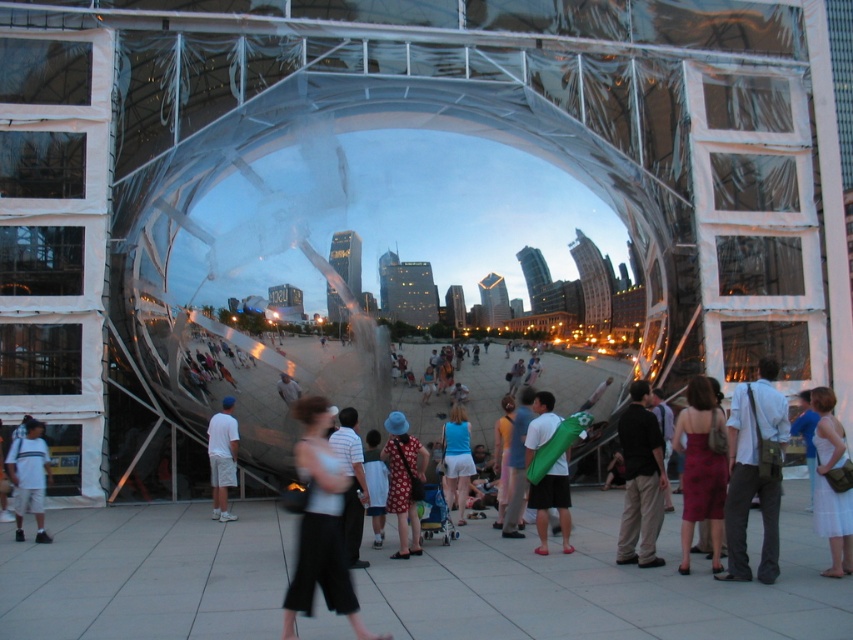
Looking at this image, who is higher up, green fabric bag at center or matte blue shorts at center?

green fabric bag at center is above.

Can you confirm if green fabric bag at center is positioned above matte blue shorts at center?

Yes.

Where is `green fabric bag at center`? green fabric bag at center is located at coordinates (552, 502).

Which is more to the right, matte red dress at center or white cotton dress at lower right?

Positioned to the right is white cotton dress at lower right.

Is matte red dress at center further to camera compared to white cotton dress at lower right?

Yes, matte red dress at center is further from the viewer.

The height and width of the screenshot is (640, 853). What do you see at coordinates (701, 468) in the screenshot?
I see `matte red dress at center` at bounding box center [701, 468].

Find the location of `matte red dress at center`. matte red dress at center is located at coordinates coord(701,468).

From the picture: Is matte white pants at center wider than white matte shorts at center?

Yes.

In the scene shown: Is matte white pants at center to the left of white matte shorts at center from the viewer's perspective?

In fact, matte white pants at center is to the right of white matte shorts at center.

I want to click on matte white pants at center, so click(321, 525).